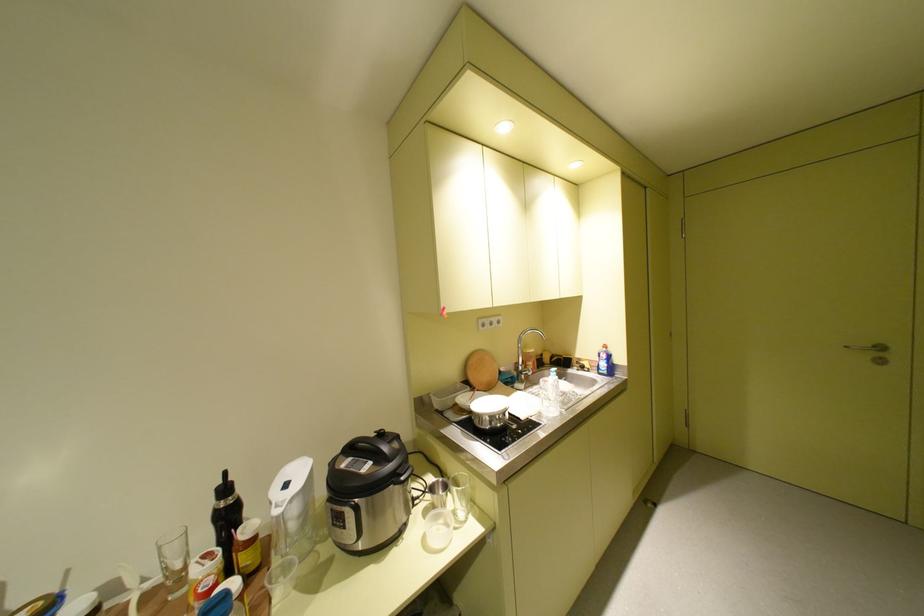
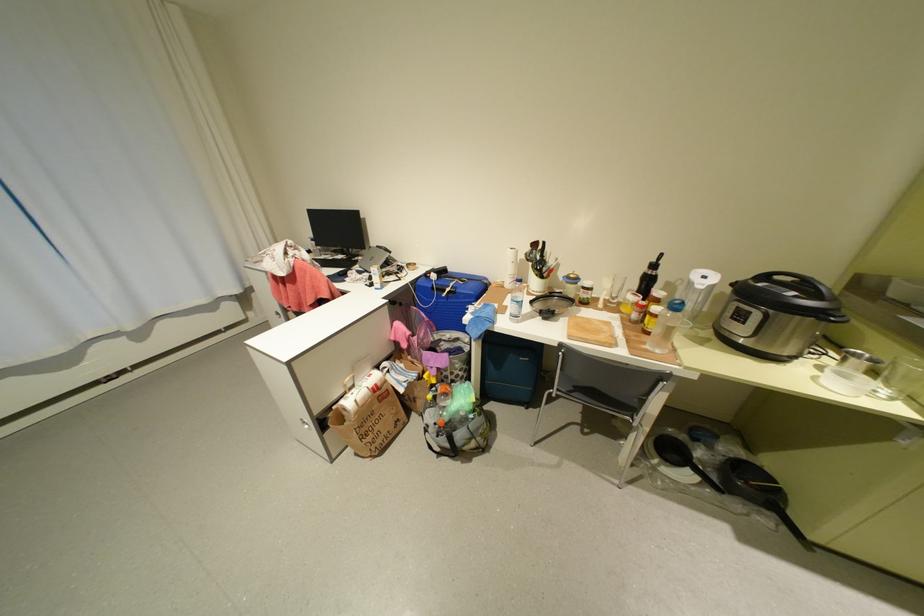
The point at (360,460) is marked in the first image. Where is the corresponding point in the second image?

(777, 284)